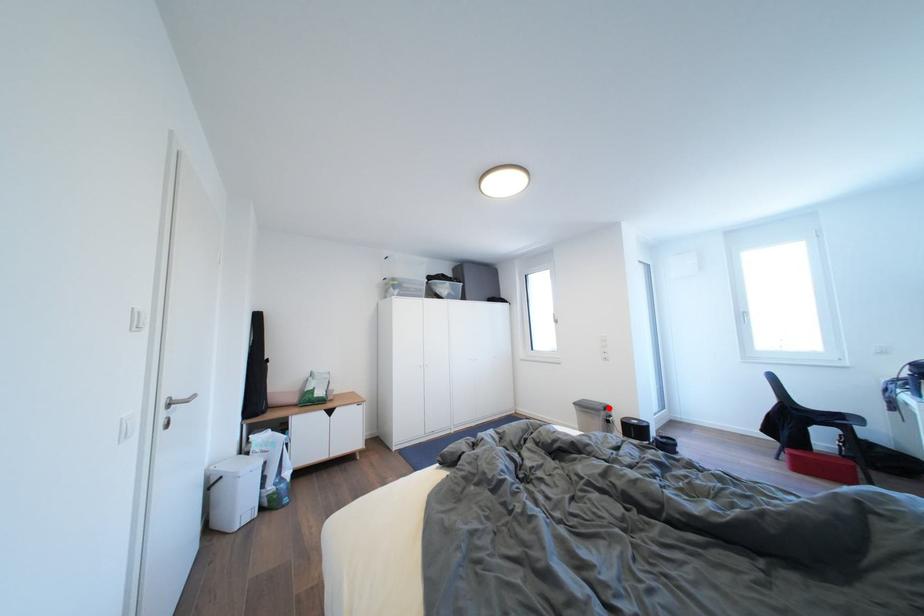
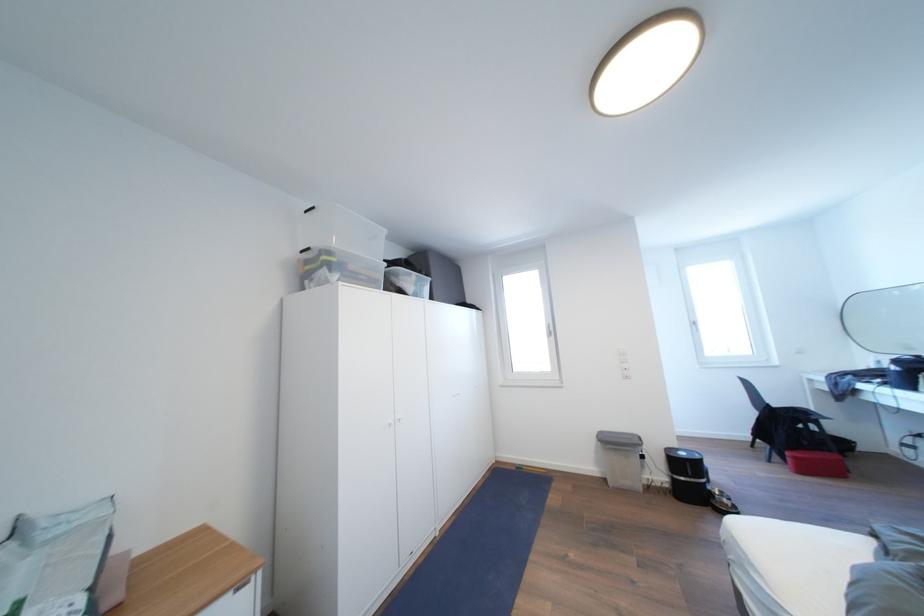
The point at the highlighted location is marked in the first image. Where is the corresponding point in the second image?

(639, 440)